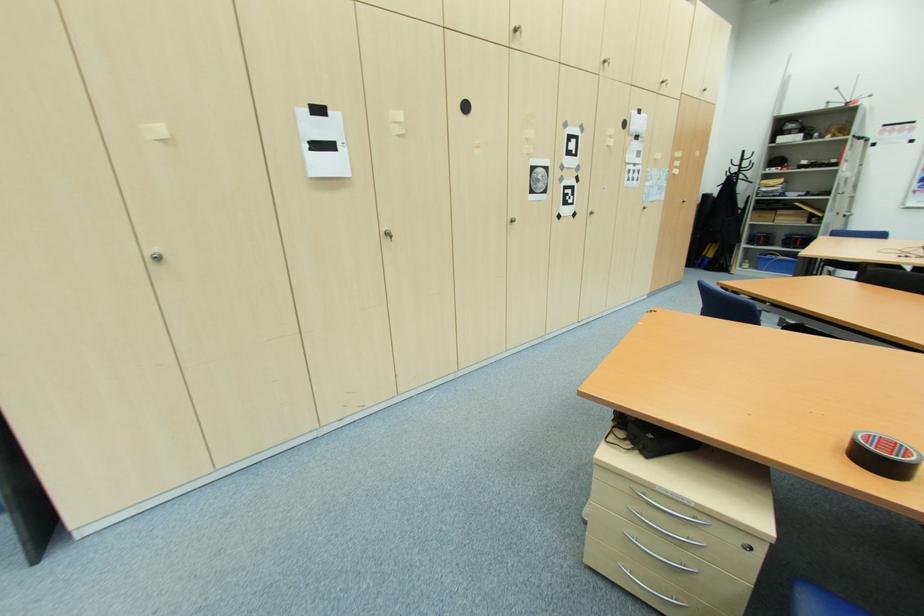
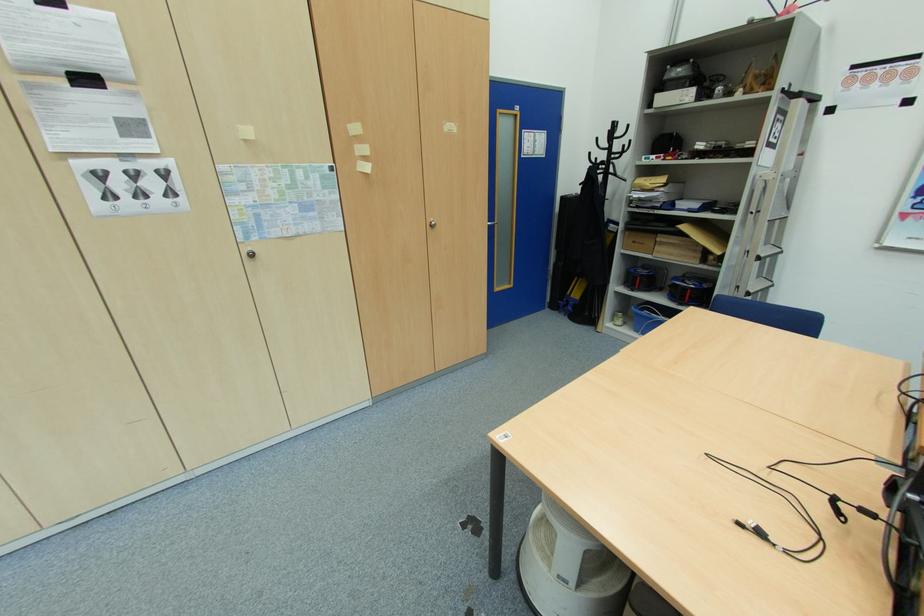
Find the pixel in the second image that matches (x=746, y=177) in the first image.

(614, 169)